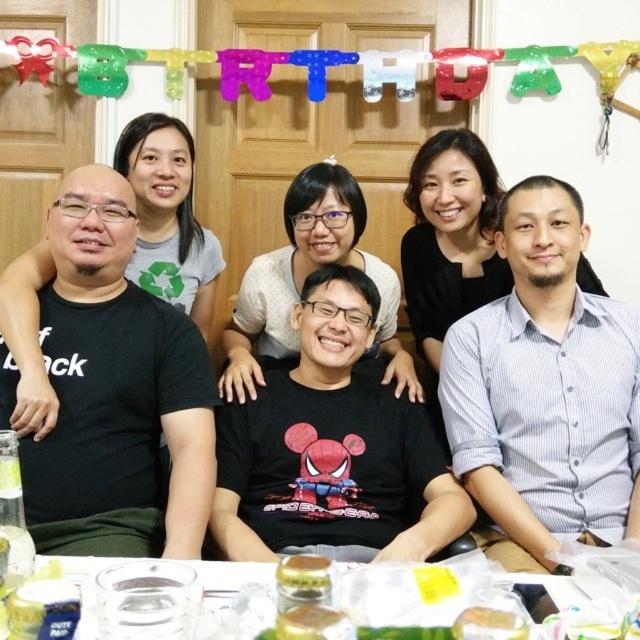
Which is in front, point (51, 403) or point (464, 632)?

Point (464, 632) is in front.

Identify the location of black matte shirt at center. (28, 339).

Between point (250, 621) and point (19, 332), which one is positioned behind?

The point (19, 332) is more distant.

Between point (356, 611) and point (6, 337), which one is positioned in front?

Point (356, 611) is more forward.

Where is `transparent plastic table at lower center`? The image size is (640, 640). transparent plastic table at lower center is located at coordinates (177, 600).

Who is positioned more to the right, transparent plastic table at lower center or translucent glass jar at lower center?

transparent plastic table at lower center

Which of these two, transparent plastic table at lower center or translucent glass jar at lower center, stands shorter?

translucent glass jar at lower center

Between point (340, 572) and point (291, 618), which one is positioned behind?

Point (340, 572)

Where is `transparent plastic table at lower center`? This screenshot has width=640, height=640. transparent plastic table at lower center is located at coordinates (177, 600).